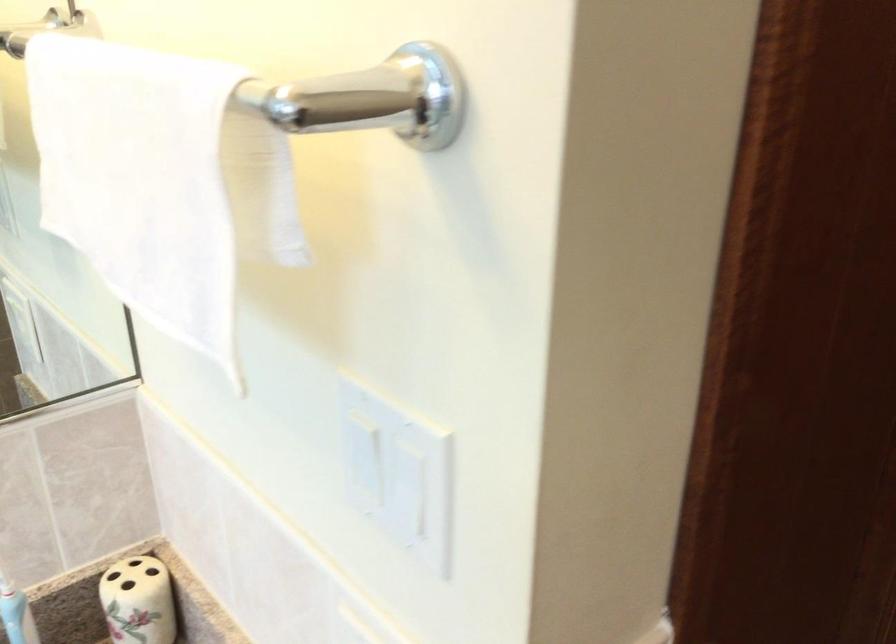
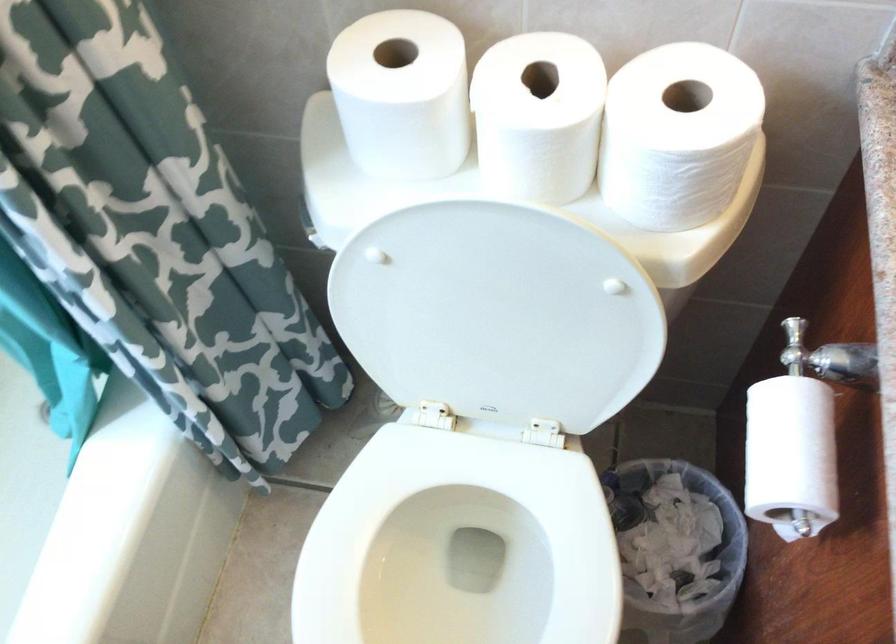
First-person continuous shooting, in which direction is the camera rotating?

The camera rotated toward left-down.